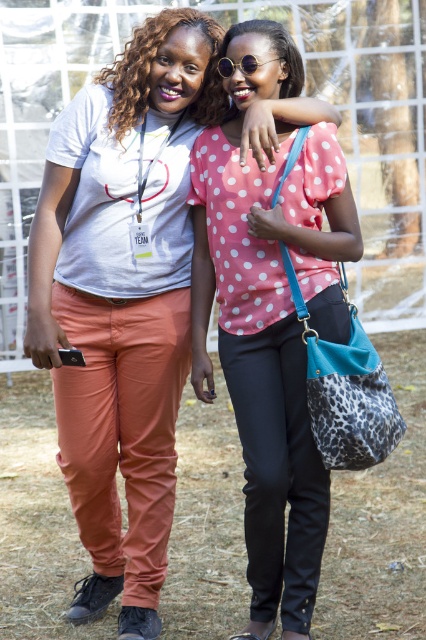
Can you confirm if pink dotted blouse at center is positioned above sunglasses at center?

Actually, pink dotted blouse at center is below sunglasses at center.

Between pink dotted blouse at center and sunglasses at center, which one appears on the right side from the viewer's perspective?

pink dotted blouse at center

Which is in front, point (288, 449) or point (255, 65)?

Positioned in front is point (255, 65).

You are a GUI agent. You are given a task and a screenshot of the screen. Output one action in this format:
    pyautogui.click(x=<x>, y=<y>)
    Task: Click on the pink dotted blouse at center
    The height and width of the screenshot is (640, 426).
    Given the screenshot: What is the action you would take?
    pyautogui.click(x=270, y=317)